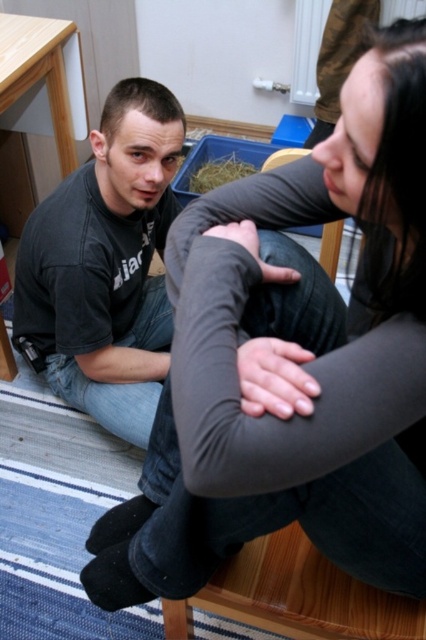
You are standing in a stable and need to place a new hay bale next to the brown straw at center. Which direction should you move from the black cotton shirt at left to reach the spot where you can place the hay bale?

The black cotton shirt at left is to the left of brown straw at center, so you should move to the right from the black cotton shirt at left to reach the brown straw at center and place the hay bale next to it.

You are organizing a clothing donation drive and need to categorize items based on their size. You have a black cotton shirt at left and a brown straw at center. Which item is bigger in size?

The black cotton shirt at left has a larger size compared to the brown straw at center, so the black cotton shirt at left is bigger.